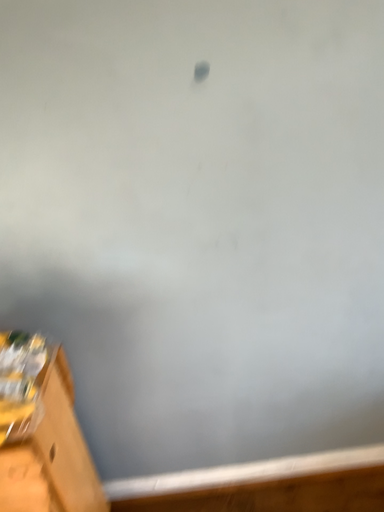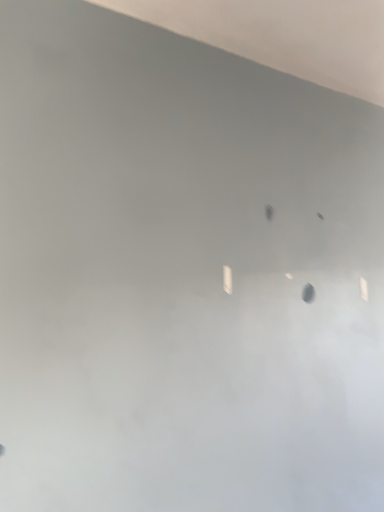
Question: Which way did the camera rotate in the video?

Choices:
 (A) rotated downward
 (B) rotated upward

Answer: (B)